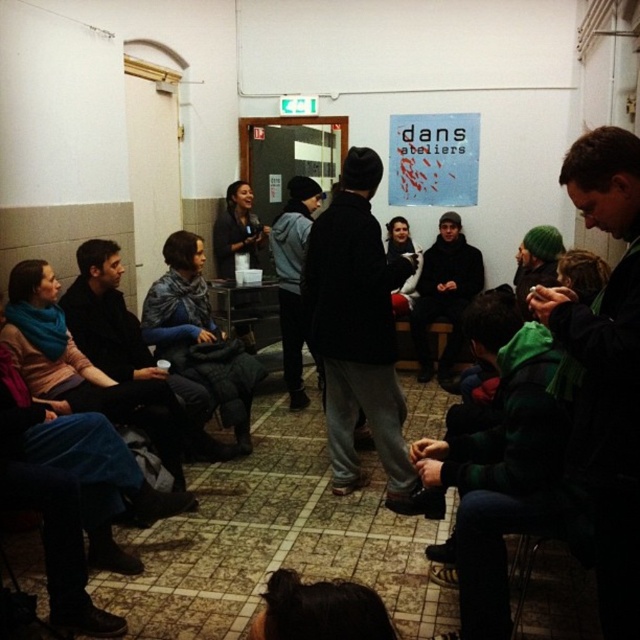
Question: Which object is farther from the camera taking this photo?

Choices:
 (A) dark blue sweater at center
 (B) dark gray knit hat at center
 (C) black woolen sweater at center

Answer: (C)

Question: Does black woolen sweater at center appear over dark gray hoodie at center?

Choices:
 (A) no
 (B) yes

Answer: (B)

Question: Which of the following is the farthest from the observer?

Choices:
 (A) dark gray hoodie at center
 (B) dark blue sweater at center
 (C) dark gray knit hat at center

Answer: (A)

Question: Is dark gray knit hat at center wider than dark blue sweater at center?

Choices:
 (A) no
 (B) yes

Answer: (A)

Question: Can you confirm if dark blue sweater at center is wider than black woolen sweater at center?

Choices:
 (A) yes
 (B) no

Answer: (A)

Question: Considering the real-world distances, which object is closest to the dark blue sweater at center?

Choices:
 (A) black woolen sweater at center
 (B) dark gray knit hat at center

Answer: (B)